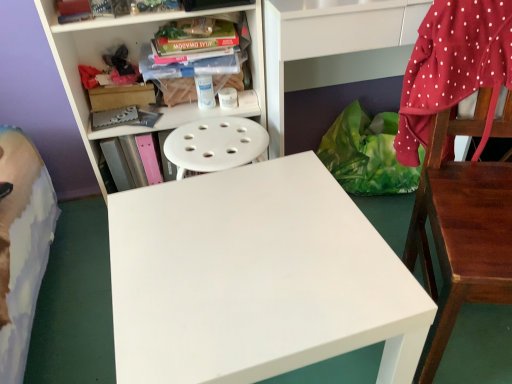
Where is `empty space that is ontop of white matte table at center`? The image size is (512, 384). empty space that is ontop of white matte table at center is located at coordinates (245, 243).